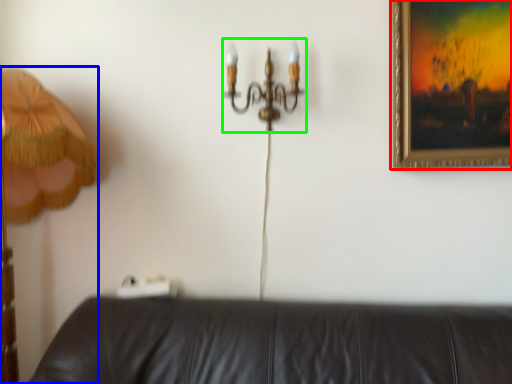
Question: Based on their relative distances, which object is nearer to picture frame (highlighted by a red box)? Choose from lamp (highlighted by a blue box) and chandelier (highlighted by a green box).

Choices:
 (A) lamp
 (B) chandelier

Answer: (B)